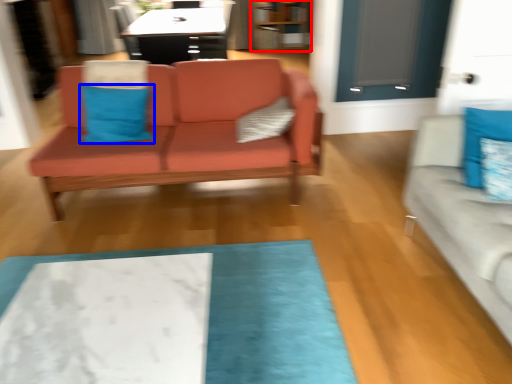
Question: Which point is further to the camera, bookshelf (highlighted by a red box) or pillow (highlighted by a blue box)?

Choices:
 (A) bookshelf
 (B) pillow

Answer: (A)